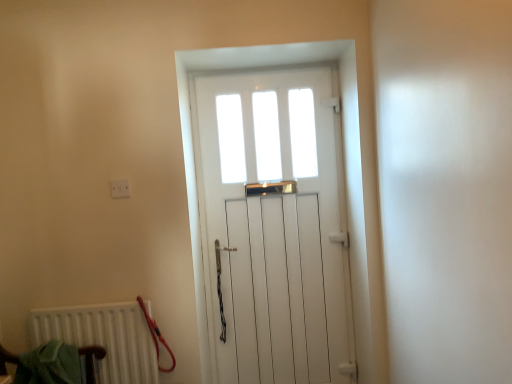
Question: Does green fabric armchair at lower left have a greater width compared to white plastic electric outlet at upper left?

Choices:
 (A) no
 (B) yes

Answer: (B)

Question: From the image's perspective, is green fabric armchair at lower left on white plastic electric outlet at upper left?

Choices:
 (A) yes
 (B) no

Answer: (B)

Question: From a real-world perspective, is green fabric armchair at lower left beneath white plastic electric outlet at upper left?

Choices:
 (A) no
 (B) yes

Answer: (B)

Question: Considering the relative positions of green fabric armchair at lower left and white plastic electric outlet at upper left in the image provided, is green fabric armchair at lower left behind white plastic electric outlet at upper left?

Choices:
 (A) yes
 (B) no

Answer: (B)

Question: Is green fabric armchair at lower left oriented away from white plastic electric outlet at upper left?

Choices:
 (A) no
 (B) yes

Answer: (A)

Question: From their relative heights in the image, would you say white matte radiator at lower left is taller or shorter than green fabric armchair at lower left?

Choices:
 (A) short
 (B) tall

Answer: (B)

Question: Considering their positions, is white matte radiator at lower left located in front of or behind green fabric armchair at lower left?

Choices:
 (A) front
 (B) behind

Answer: (B)

Question: Considering the positions of point (61, 319) and point (88, 377), is point (61, 319) closer or farther from the camera than point (88, 377)?

Choices:
 (A) closer
 (B) farther

Answer: (B)

Question: From a real-world perspective, is white matte radiator at lower left above or below green fabric armchair at lower left?

Choices:
 (A) below
 (B) above

Answer: (B)

Question: Considering the relative positions of white plastic electric outlet at upper left and white wooden door at center in the image provided, is white plastic electric outlet at upper left to the left or to the right of white wooden door at center?

Choices:
 (A) right
 (B) left

Answer: (B)

Question: Considering the positions of white plastic electric outlet at upper left and white wooden door at center in the image, is white plastic electric outlet at upper left taller or shorter than white wooden door at center?

Choices:
 (A) tall
 (B) short

Answer: (B)

Question: From a real-world perspective, is white plastic electric outlet at upper left physically located above or below white wooden door at center?

Choices:
 (A) above
 (B) below

Answer: (A)

Question: Is white plastic electric outlet at upper left situated inside white wooden door at center or outside?

Choices:
 (A) inside
 (B) outside

Answer: (B)

Question: Does point (113, 190) appear closer or farther from the camera than point (122, 357)?

Choices:
 (A) farther
 (B) closer

Answer: (A)

Question: Considering the positions of white plastic electric outlet at upper left and white matte radiator at lower left in the image, is white plastic electric outlet at upper left wider or thinner than white matte radiator at lower left?

Choices:
 (A) wide
 (B) thin

Answer: (B)